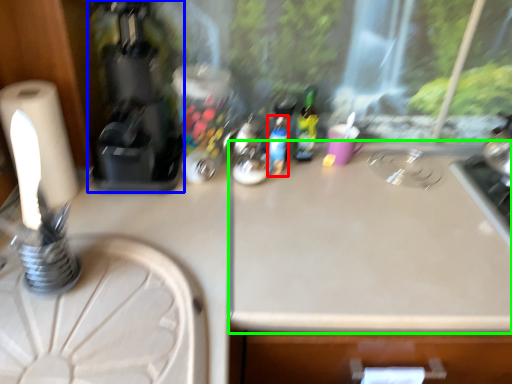
Question: Which object is positioned farthest from bottle (highlighted by a red box)? Select from coffee machine (highlighted by a blue box) and counter top (highlighted by a green box).

Choices:
 (A) coffee machine
 (B) counter top

Answer: (A)